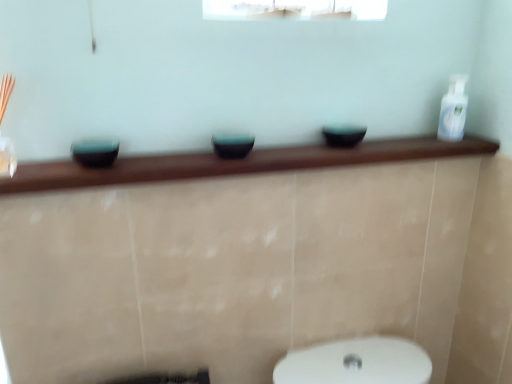
Question: Is white glossy bottle at upper right outside matte black bowl at center, which ranks as the 1th basin in right-to-left order?

Choices:
 (A) yes
 (B) no

Answer: (A)

Question: From the image's perspective, is white glossy bottle at upper right over matte black bowl at center, which ranks as the 1th basin in right-to-left order?

Choices:
 (A) no
 (B) yes

Answer: (B)

Question: From a real-world perspective, is white glossy bottle at upper right physically above matte black bowl at center, which ranks as the 1th basin in right-to-left order?

Choices:
 (A) yes
 (B) no

Answer: (A)

Question: Is white glossy bottle at upper right positioned with its back to matte black bowl at center, which ranks as the 1th basin in right-to-left order?

Choices:
 (A) no
 (B) yes

Answer: (A)

Question: Is white glossy bottle at upper right closer to camera compared to matte black bowl at center, which ranks as the 1th basin in right-to-left order?

Choices:
 (A) no
 (B) yes

Answer: (A)

Question: From the image's perspective, would you say white glossy bottle at upper right is shown under matte black bowl at center, which ranks as the 1th basin in right-to-left order?

Choices:
 (A) yes
 (B) no

Answer: (B)

Question: Does matte black bowl at center, which ranks as the 1th basin in right-to-left order, have a greater width compared to matte black bowl at center, which is the 2th basin from left to right?

Choices:
 (A) no
 (B) yes

Answer: (B)

Question: From the image's perspective, does matte black bowl at center, which ranks as the 1th basin in right-to-left order, appear higher than matte black bowl at center, which is the 2th basin from left to right?

Choices:
 (A) yes
 (B) no

Answer: (A)

Question: Considering the relative positions of matte black bowl at center, the 3th basin from the left, and matte black bowl at center, which is the 2th basin from left to right, in the image provided, is matte black bowl at center, the 3th basin from the left, to the left of matte black bowl at center, which is the 2th basin from left to right, from the viewer's perspective?

Choices:
 (A) no
 (B) yes

Answer: (A)

Question: Is matte black bowl at center, the 2th basin when ordered from right to left, completely or partially inside matte black bowl at center, the 3th basin from the left?

Choices:
 (A) yes
 (B) no

Answer: (B)

Question: Is matte black bowl at center, which ranks as the 1th basin in right-to-left order, beside matte black bowl at center, which is the 2th basin from left to right?

Choices:
 (A) yes
 (B) no

Answer: (B)

Question: Does matte black bowl at center, the 3th basin from the left, have a greater height compared to matte black bowl at center, which is the 2th basin from left to right?

Choices:
 (A) no
 (B) yes

Answer: (A)

Question: From the image's perspective, is white glossy bottle at upper right located above teal glossy bowl at left, which appears as the 1th basin when viewed from the left?

Choices:
 (A) no
 (B) yes

Answer: (B)